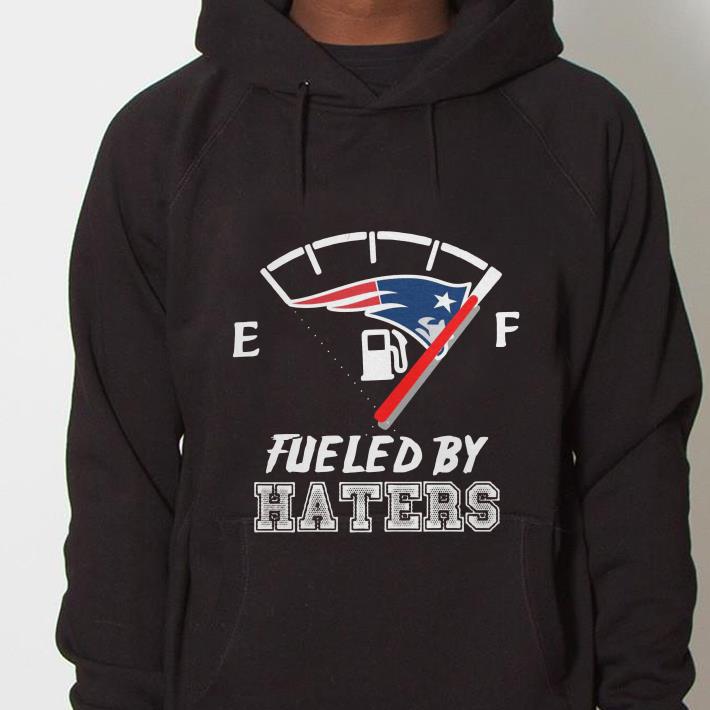
You are a GUI agent. You are given a task and a screenshot of the screen. Output one action in this format:
    pyautogui.click(x=<x>, y=<y>)
    Task: Click on the hood
    
    Given the screenshot: What is the action you would take?
    pyautogui.click(x=513, y=20)